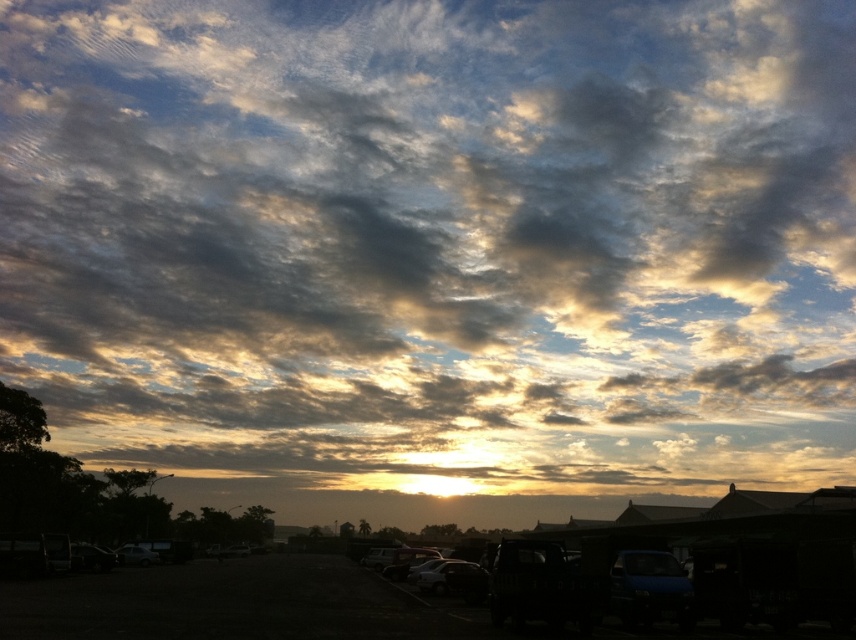
Question: Is shiny silver car at center positioned in front of matte black car at lower left?

Choices:
 (A) yes
 (B) no

Answer: (A)

Question: Does white matte car at center have a lesser width compared to shiny silver car at center?

Choices:
 (A) no
 (B) yes

Answer: (B)

Question: From the image, what is the correct spatial relationship of white matte car at center in relation to matte black car at lower left?

Choices:
 (A) right
 (B) left

Answer: (A)

Question: Among these objects, which one is nearest to the camera?

Choices:
 (A) shiny silver car at center
 (B) matte black car at lower left

Answer: (A)

Question: Which object is the farthest from the shiny silver car at center?

Choices:
 (A) white matte car at center
 (B) matte black car at lower left

Answer: (B)

Question: Which of these objects is positioned closest to the shiny silver car at center?

Choices:
 (A) white matte car at center
 (B) matte black car at lower left

Answer: (A)